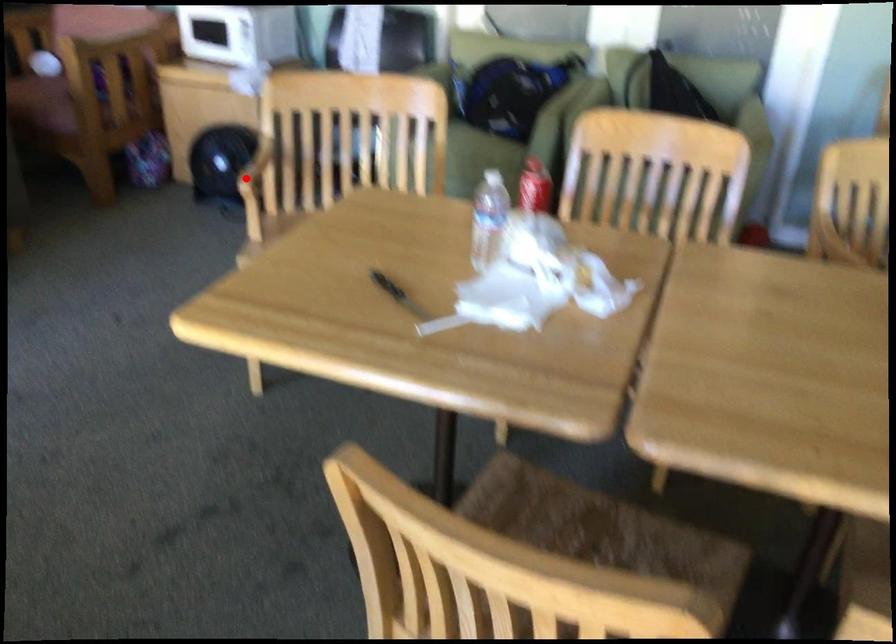
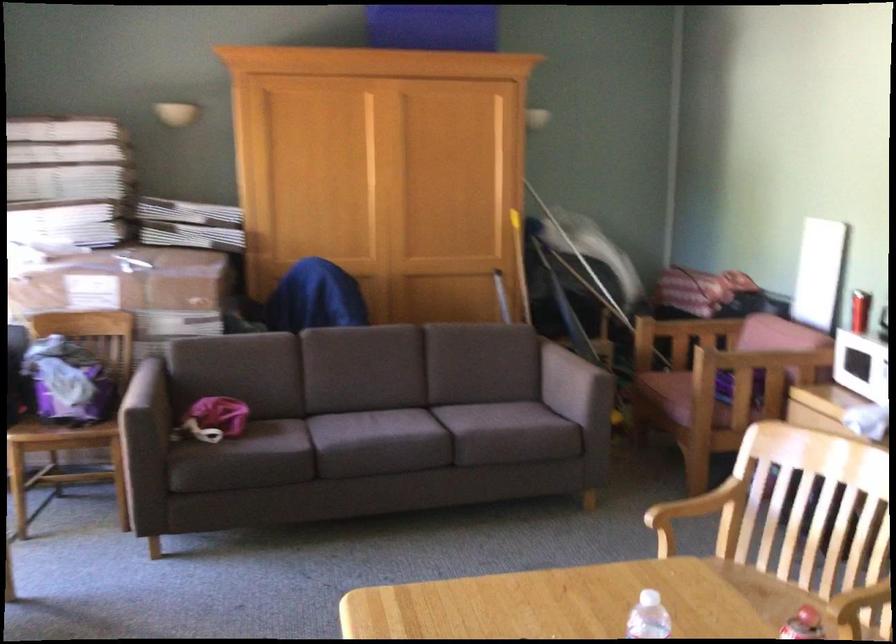
Find the pixel in the second image that matches the highlighted location in the first image.

(694, 512)